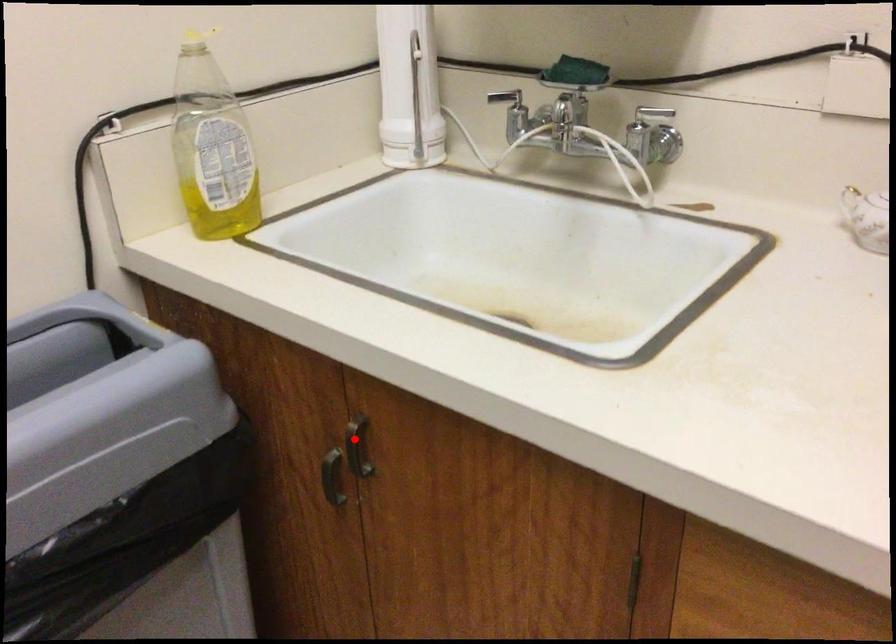
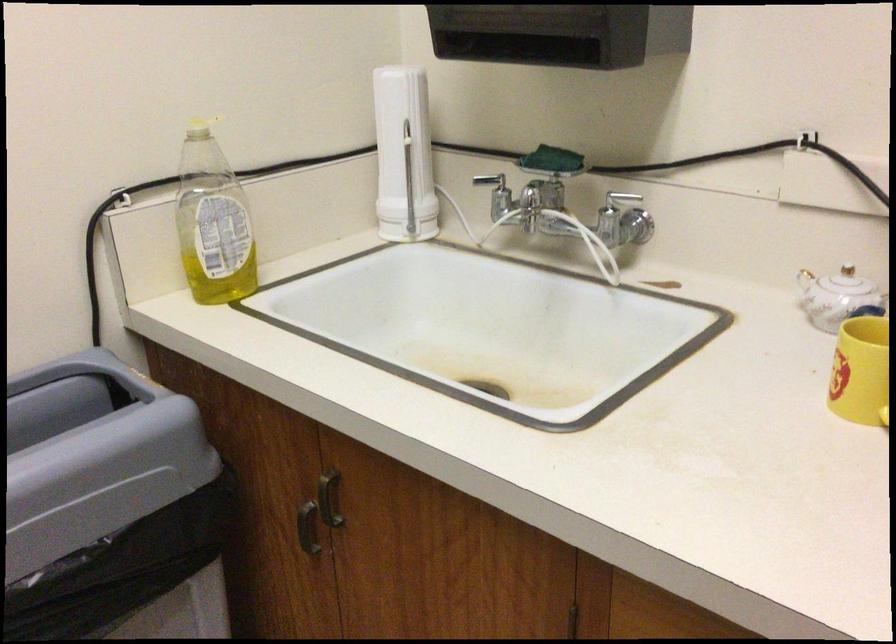
In the second image, find the point that corresponds to the highlighted location in the first image.

(328, 498)